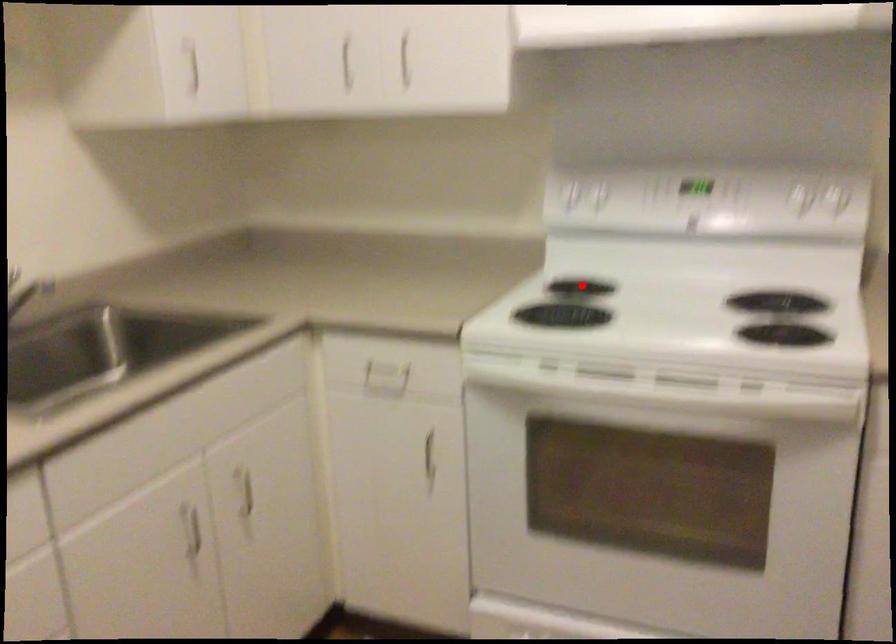
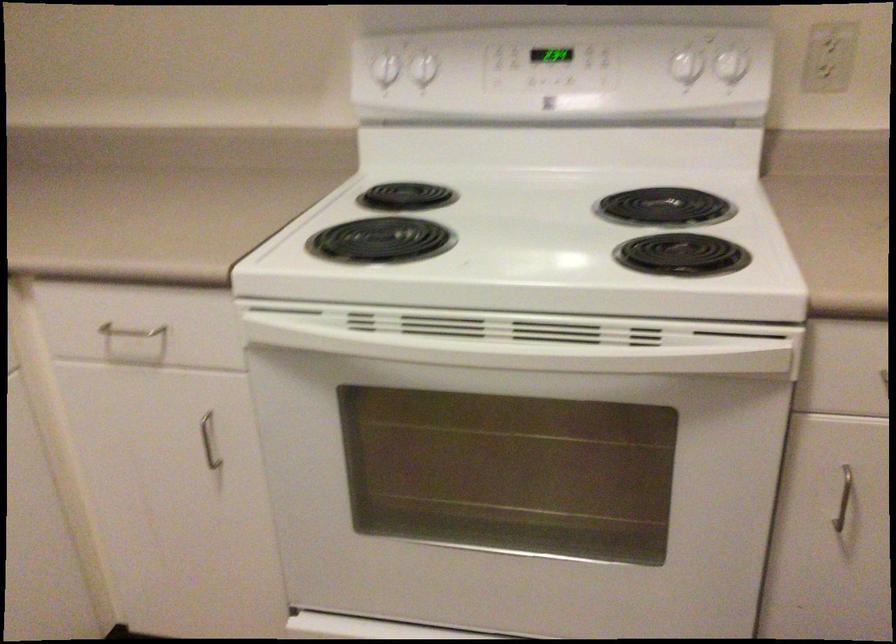
Question: I am providing you with two images of the same scene from different viewpoints. Given a red point in image1, look at the same physical point in image2. Is it:

Choices:
 (A) Closer to the viewpoint
 (B) Farther from the viewpoint

Answer: (A)